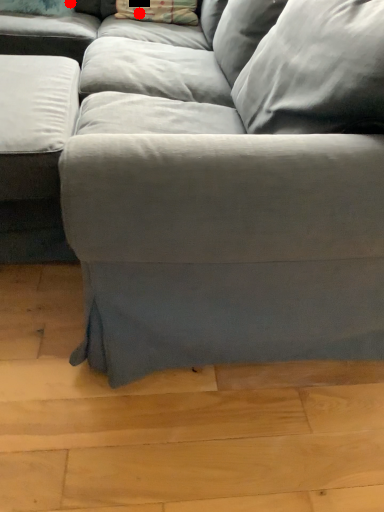
Question: Two points are circled on the image, labeled by A and B beside each circle. Among these points, which one is farthest from the camera?

Choices:
 (A) A is further
 (B) B is further

Answer: (A)